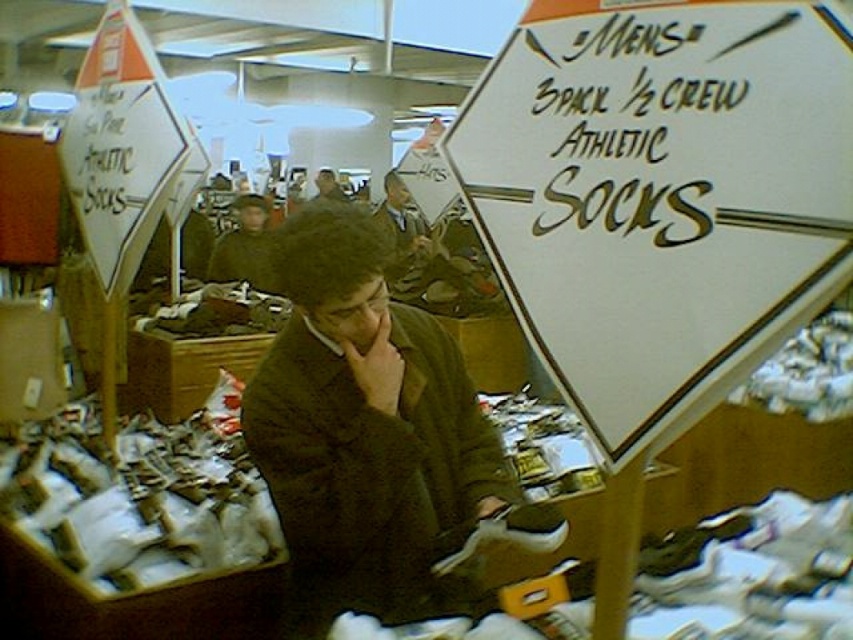
Can you confirm if white leather shoe at lower center is shorter than brown fuzzy hat at upper center?

Indeed, white leather shoe at lower center has a lesser height compared to brown fuzzy hat at upper center.

Does white leather shoe at lower center have a smaller size compared to brown fuzzy hat at upper center?

Yes.

Find the location of a particular element. white leather shoe at lower center is located at coordinates (508, 532).

Does white leather shoe at lower center have a greater height compared to dark brown jacket at center?

In fact, white leather shoe at lower center may be shorter than dark brown jacket at center.

Who is positioned more to the right, white leather shoe at lower center or dark brown jacket at center?

white leather shoe at lower center is more to the right.

Describe the element at coordinates (508, 532) in the screenshot. I see `white leather shoe at lower center` at that location.

Identify the location of white leather shoe at lower center. This screenshot has height=640, width=853. (508, 532).

Which is more to the left, brown fuzzy jacket at center or white leather shoe at lower center?

brown fuzzy jacket at center

Is brown fuzzy jacket at center to the right of white leather shoe at lower center from the viewer's perspective?

In fact, brown fuzzy jacket at center is to the left of white leather shoe at lower center.

Locate an element on the screen. The width and height of the screenshot is (853, 640). brown fuzzy jacket at center is located at coordinates (366, 433).